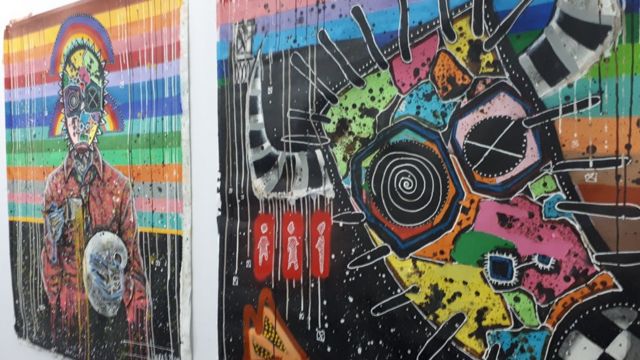
The height and width of the screenshot is (360, 640). Identify the location of art on right. (291, 29), (534, 19), (544, 286), (304, 339).